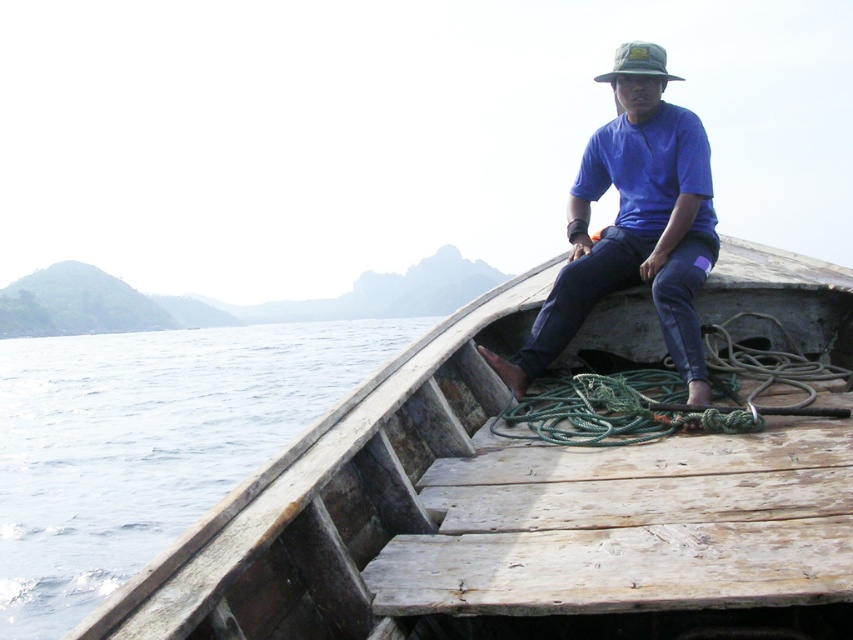
Question: Can you confirm if green rope at center is thinner than green fabric hat at upper center?

Choices:
 (A) no
 (B) yes

Answer: (B)

Question: Which object appears closest to the camera in this image?

Choices:
 (A) clear blue water at lower left
 (B) green fabric hat at upper center
 (C) green rope at center

Answer: (C)

Question: Can you confirm if green rope at center is bigger than green fabric hat at upper center?

Choices:
 (A) yes
 (B) no

Answer: (B)

Question: Does clear blue water at lower left come behind green fabric hat at upper center?

Choices:
 (A) yes
 (B) no

Answer: (A)

Question: Which object is the farthest from the green fabric hat at upper center?

Choices:
 (A) wooden boat at center
 (B) green rope at center
 (C) clear blue water at lower left

Answer: (C)

Question: Among these points, which one is farthest from the camera?

Choices:
 (A) (605, 292)
 (B) (643, 64)

Answer: (A)